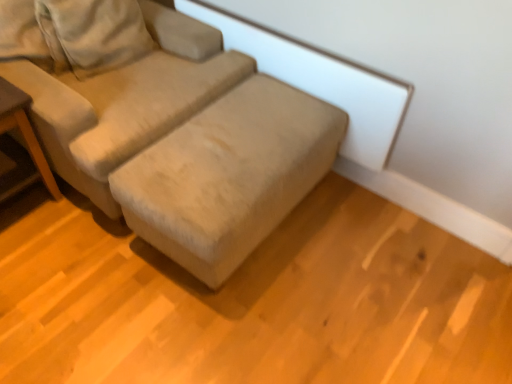
Question: Is beige fabric couch at center inside wooden table at left?

Choices:
 (A) yes
 (B) no

Answer: (B)

Question: Does wooden table at left have a larger size compared to beige fabric couch at center?

Choices:
 (A) yes
 (B) no

Answer: (B)

Question: Would you consider wooden table at left to be distant from beige fabric couch at center?

Choices:
 (A) no
 (B) yes

Answer: (A)

Question: Could you tell me if wooden table at left is turned towards beige fabric couch at center?

Choices:
 (A) yes
 (B) no

Answer: (B)

Question: Considering the relative positions of wooden table at left and beige fabric couch at center in the image provided, is wooden table at left to the left of beige fabric couch at center from the viewer's perspective?

Choices:
 (A) yes
 (B) no

Answer: (A)

Question: Would you say wooden table at left is outside beige fabric couch at center?

Choices:
 (A) no
 (B) yes

Answer: (B)

Question: Is beige fabric couch at center positioned beyond the bounds of wooden table at left?

Choices:
 (A) no
 (B) yes

Answer: (B)

Question: Does beige fabric couch at center turn towards wooden table at left?

Choices:
 (A) yes
 (B) no

Answer: (B)

Question: From the image's perspective, is beige fabric couch at center over wooden table at left?

Choices:
 (A) no
 (B) yes

Answer: (B)

Question: Considering the relative sizes of beige fabric couch at center and wooden table at left in the image provided, is beige fabric couch at center shorter than wooden table at left?

Choices:
 (A) yes
 (B) no

Answer: (B)

Question: Is beige fabric couch at center bigger than wooden table at left?

Choices:
 (A) no
 (B) yes

Answer: (B)

Question: From a real-world perspective, is beige fabric couch at center located higher than wooden table at left?

Choices:
 (A) no
 (B) yes

Answer: (B)

Question: In the image, is wooden table at left positioned in front of or behind beige fabric couch at center?

Choices:
 (A) front
 (B) behind

Answer: (B)